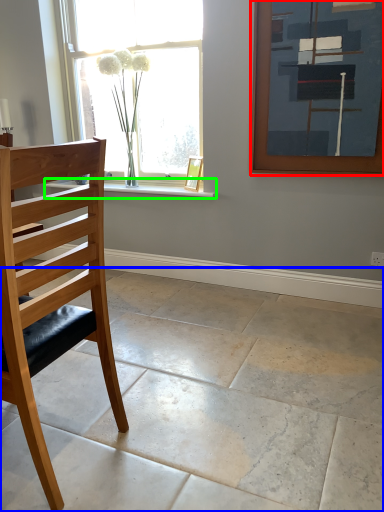
Question: Based on their relative distances, which object is nearer to picture frame (highlighted by a red box)? Choose from concrete (highlighted by a blue box) and window sill (highlighted by a green box).

Choices:
 (A) concrete
 (B) window sill

Answer: (B)